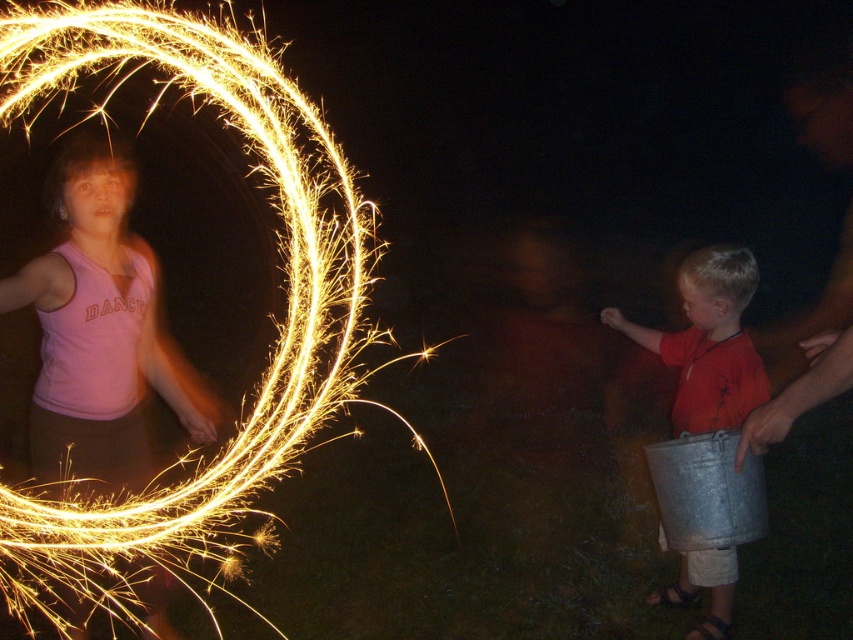
Which is in front, point (107, 588) or point (694, 333)?

Point (107, 588) is more forward.

Is bright metallic sparkler at upper left above metallic bucket at right?

Yes.

At what (x,y) coordinates should I click in order to perform the action: click on bright metallic sparkler at upper left. Please return your answer as a coordinate pair (x, y). The image size is (853, 640). Looking at the image, I should click on (279, 324).